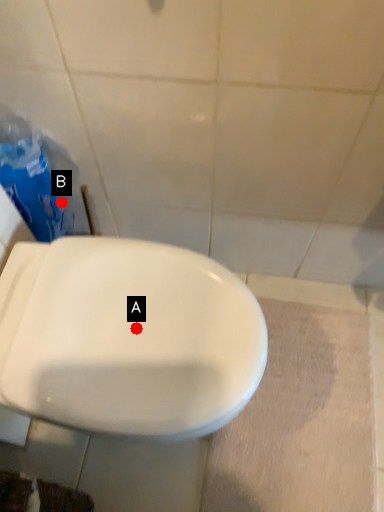
Question: Two points are circled on the image, labeled by A and B beside each circle. Which of the following is the farthest from the observer?

Choices:
 (A) A is further
 (B) B is further

Answer: (B)